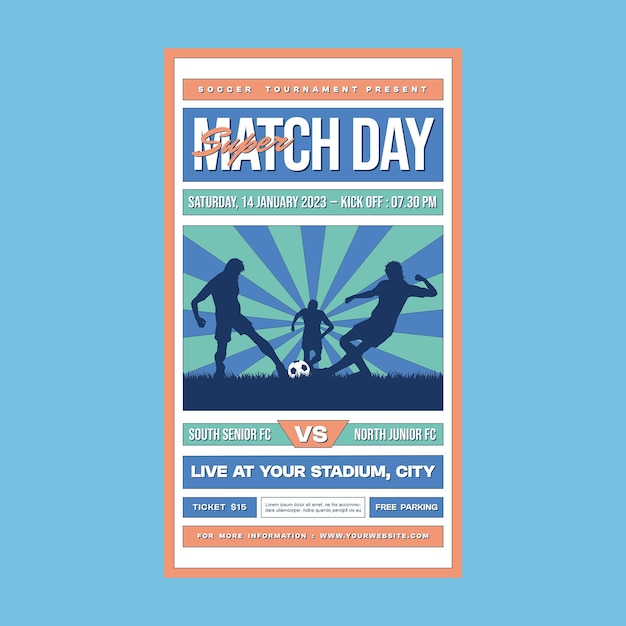
In order to click on poster in this screenshot , I will do `click(295, 365)`.